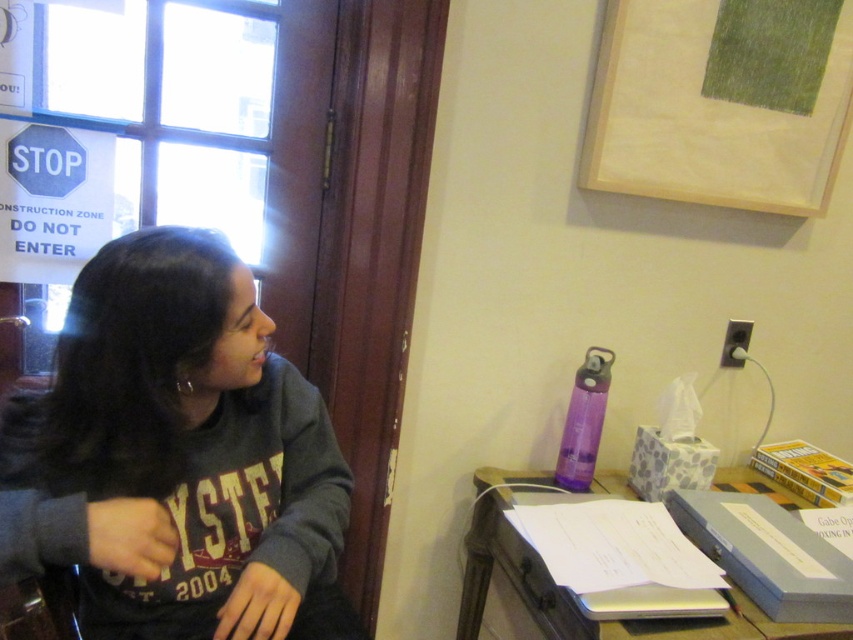
You are organizing a desk and want to place a new item between the gray fleece sweatshirt at center and the metallic silver laptop at center. Considering their sizes, which item should be placed closer to the edge of the desk to ensure there is enough space?

The metallic silver laptop at center should be placed closer to the edge of the desk since the gray fleece sweatshirt at center is much taller and therefore likely takes up more vertical space, requiring more room behind it.

You are organizing the desk items and need to place the metallic silver laptop at center. Where should you move it so it is no longer behind the gray fleece sweatshirt at center?

The metallic silver laptop at center is currently behind the gray fleece sweatshirt at center. To move it so it is no longer behind, you should place it in a position where it is not obscured by the sweatshirt, such as to the side or in front of the sweatshirt.